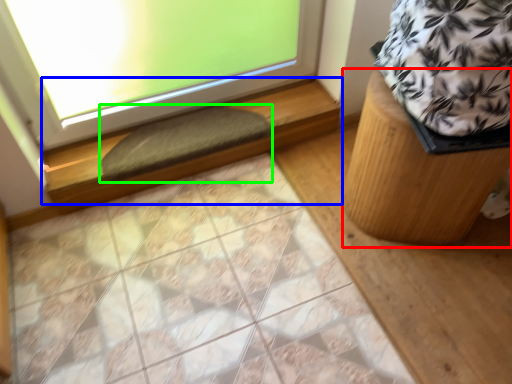
Question: Which object is the farthest from furniture (highlighted by a red box)? Choose among these: window sill (highlighted by a blue box) or doormat (highlighted by a green box).

Choices:
 (A) window sill
 (B) doormat

Answer: (B)